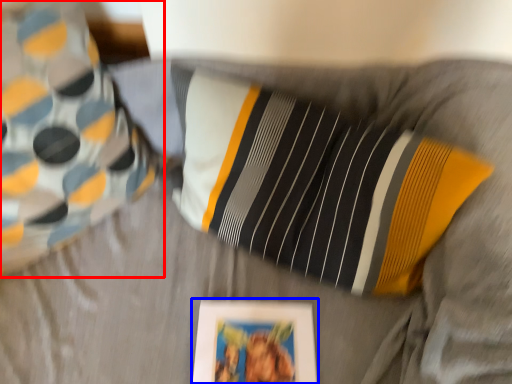
Question: Which of the following is the closest to the observer, pillow (highlighted by a red box) or picture frame (highlighted by a blue box)?

Choices:
 (A) pillow
 (B) picture frame

Answer: (A)